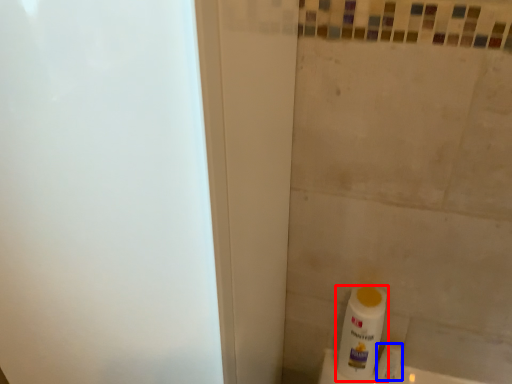
Question: Which object appears closest to the camera in this image, bottle (highlighted by a red box) or toilet paper (highlighted by a blue box)?

Choices:
 (A) bottle
 (B) toilet paper

Answer: (A)